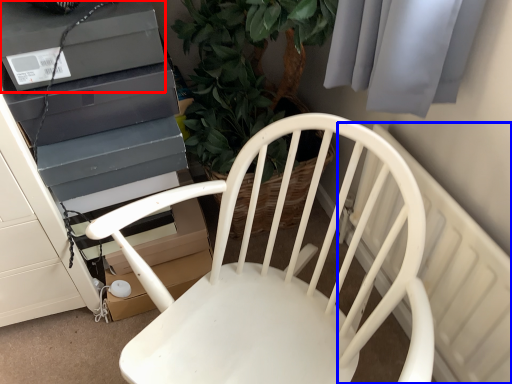
Question: Which object appears farthest to the camera in this image, appliance (highlighted by a red box) or radiator (highlighted by a blue box)?

Choices:
 (A) appliance
 (B) radiator

Answer: (A)